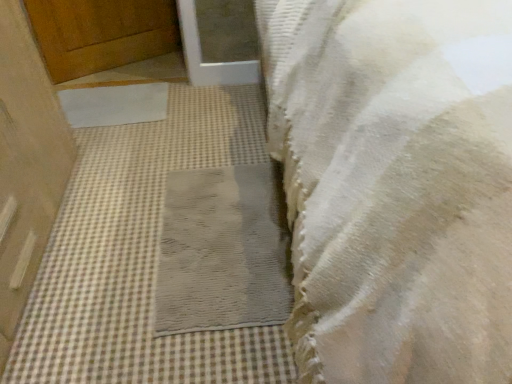
Question: In the image, is gray textured mat at center, placed as the 2th mat when sorted from left to right, positioned in front of or behind white textured towel at lower right?

Choices:
 (A) front
 (B) behind

Answer: (B)

Question: Would you say gray textured mat at center, the 2th mat in the back-to-front sequence, is to the left or to the right of white textured towel at lower right in the picture?

Choices:
 (A) left
 (B) right

Answer: (A)

Question: Considering the real-world distances, which object is farthest from the wooden door at left, acting as the first door starting from the front?

Choices:
 (A) white matte mat at center, marked as the 1th mat in a back-to-front arrangement
 (B) wooden door at upper left, the second door positioned from the bottom
 (C) white textured towel at lower right
 (D) gray textured mat at center, placed as the 2th mat when sorted from left to right

Answer: (C)

Question: Estimate the real-world distances between objects in this image. Which object is farther from the white matte mat at center, the 2th mat in the front-to-back sequence?

Choices:
 (A) wooden door at left, which is the second door in top-to-bottom order
 (B) gray textured mat at center, placed as the 2th mat when sorted from left to right
 (C) white textured towel at lower right
 (D) wooden door at upper left, which appears as the 1th door when viewed from the back

Answer: (C)